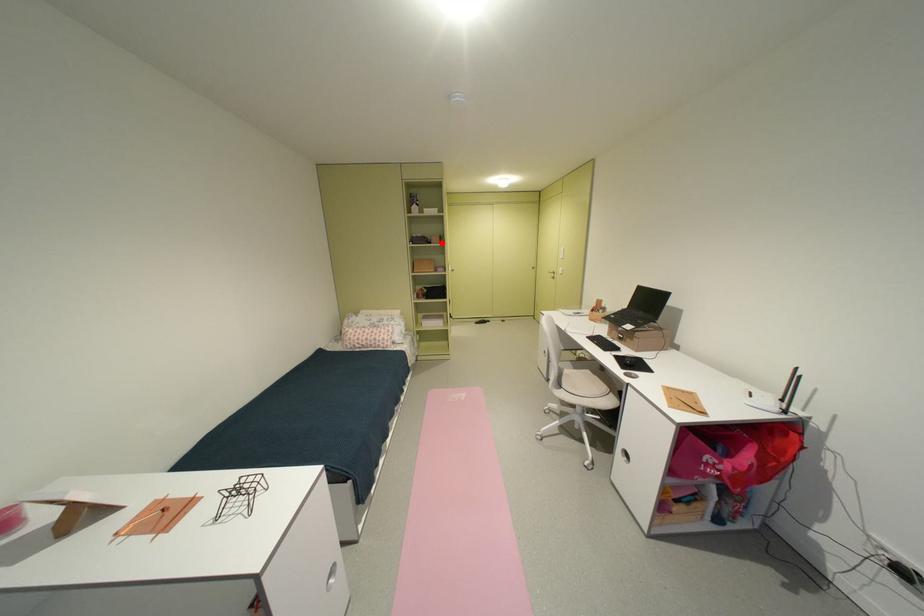
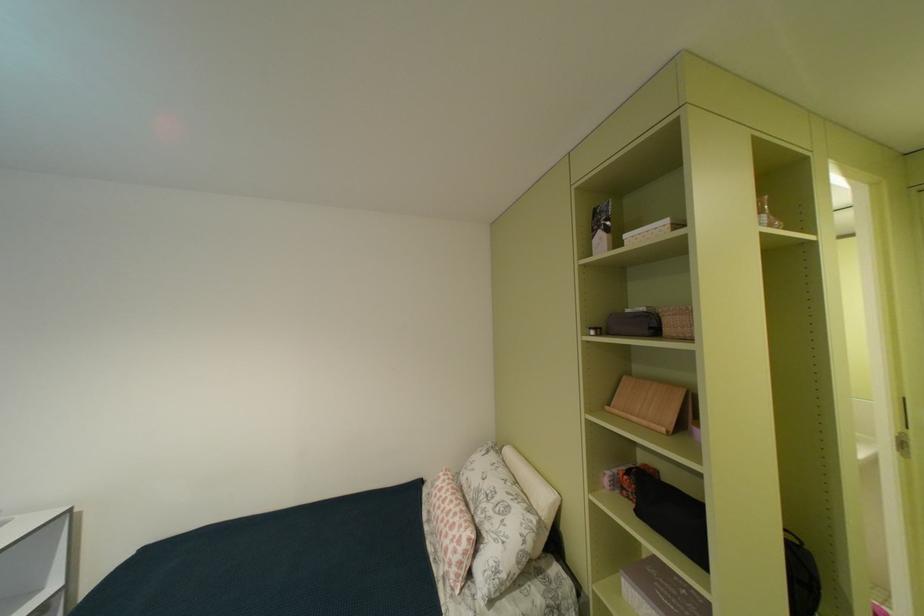
Question: I am providing you with two images of the same scene from different viewpoints. A red point is shown in image1. For the corresponding object point in image2, is it positioned nearer or farther from the camera?

Choices:
 (A) Nearer
 (B) Farther

Answer: (B)